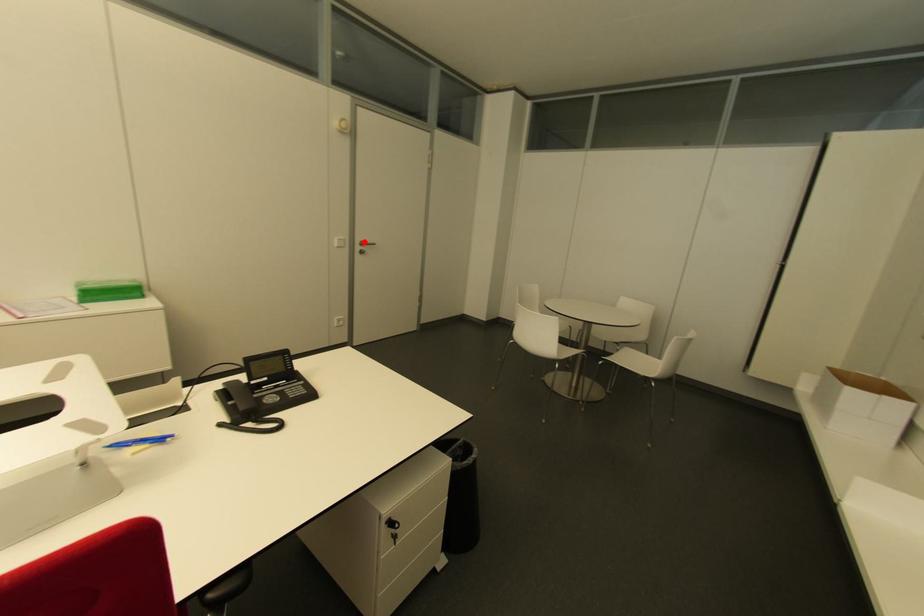
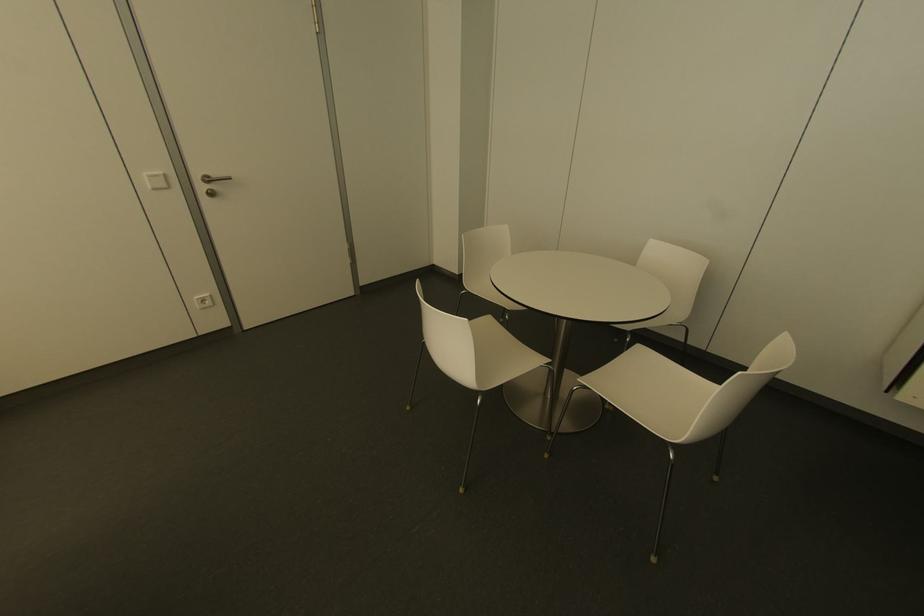
Where in the second image is the point corresponding to the highlighted location from the first image?

(213, 175)